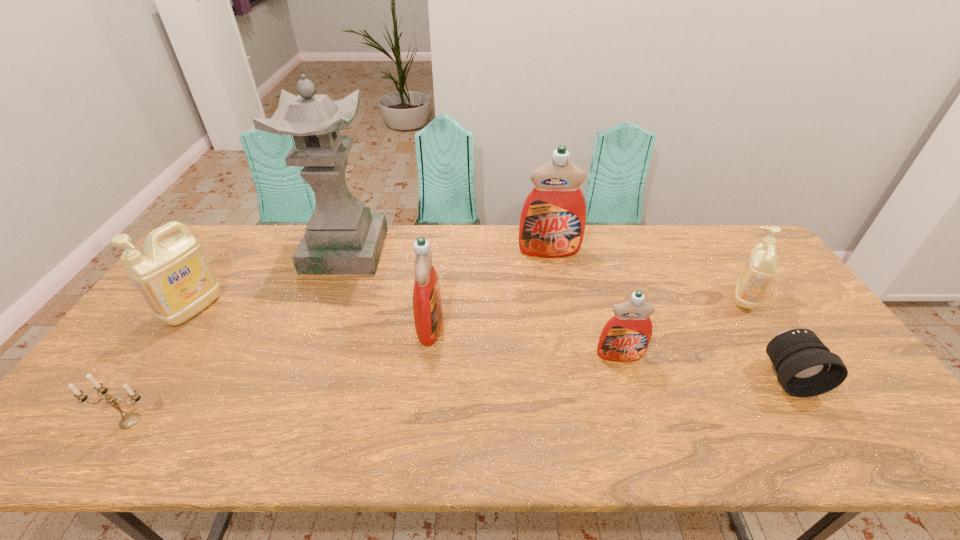
Find the location of a particular element. gray sculpture is located at coordinates (342, 237).

Image resolution: width=960 pixels, height=540 pixels. In order to click on the third object from left to right in this screenshot , I will do `click(342, 237)`.

The image size is (960, 540). Find the location of `the biggest red detergent`. the biggest red detergent is located at coordinates (552, 223).

Locate an element on the screen. the farthest detergent is located at coordinates (552, 223).

The image size is (960, 540). Find the location of `the fourth detergent from right to left`. the fourth detergent from right to left is located at coordinates (427, 305).

Where is `the fourth object from left to right`? This screenshot has width=960, height=540. the fourth object from left to right is located at coordinates [427, 305].

This screenshot has width=960, height=540. Find the location of `the leftmost detergent`. the leftmost detergent is located at coordinates (174, 277).

The image size is (960, 540). Find the location of `the left beige detergent`. the left beige detergent is located at coordinates (174, 277).

This screenshot has height=540, width=960. In order to click on the rightmost detergent in this screenshot , I will do `click(761, 266)`.

What are the coordinates of `the right beige detergent` in the screenshot? It's located at (761, 266).